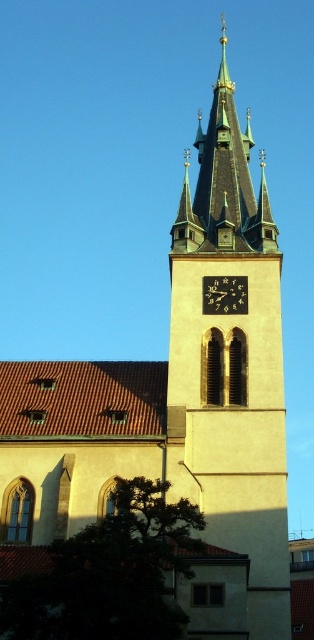
Can you confirm if green stone clock tower at center is smaller than greenish-golden spire at center?

Incorrect, green stone clock tower at center is not smaller in size than greenish-golden spire at center.

Does green stone clock tower at center appear on the left side of greenish-golden spire at center?

In fact, green stone clock tower at center is to the right of greenish-golden spire at center.

Where is `green stone clock tower at center`? green stone clock tower at center is located at coordinates (231, 364).

Identify the location of green stone clock tower at center. (231, 364).

Between green stone clock tower at center and black metallic clock at center, which one appears on the left side from the viewer's perspective?

black metallic clock at center is more to the left.

Find the location of a particular element. The height and width of the screenshot is (640, 314). green stone clock tower at center is located at coordinates (231, 364).

Locate an element on the screen. This screenshot has height=640, width=314. green stone clock tower at center is located at coordinates (231, 364).

This screenshot has width=314, height=640. Identify the location of greenish-golden spire at center. (223, 184).

How much distance is there between greenish-golden spire at center and black metallic clock at center?

A distance of 13.03 meters exists between greenish-golden spire at center and black metallic clock at center.

Which is in front, point (247, 241) or point (225, 291)?

Point (225, 291) is more forward.

This screenshot has width=314, height=640. Identify the location of greenish-golden spire at center. (223, 184).